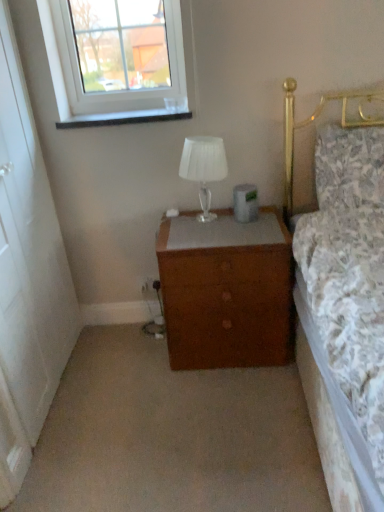
Question: Considering the positions of brown wooden chest of drawers at center and floral fabric pillow at upper right in the image, is brown wooden chest of drawers at center wider or thinner than floral fabric pillow at upper right?

Choices:
 (A) wide
 (B) thin

Answer: (A)

Question: Which is correct: brown wooden chest of drawers at center is inside floral fabric pillow at upper right, or outside of it?

Choices:
 (A) inside
 (B) outside

Answer: (B)

Question: Which object is the closest to the translucent glass lamp at center?

Choices:
 (A) brown wooden chest of drawers at center
 (B) floral fabric pillow at upper right
 (C) clear glass window at upper left
 (D) brown wooden chest of drawers at center

Answer: (D)

Question: Considering the real-world distances, which object is closest to the clear glass window at upper left?

Choices:
 (A) translucent glass lamp at center
 (B) floral fabric pillow at upper right
 (C) brown wooden chest of drawers at center
 (D) brown wooden chest of drawers at center

Answer: (A)